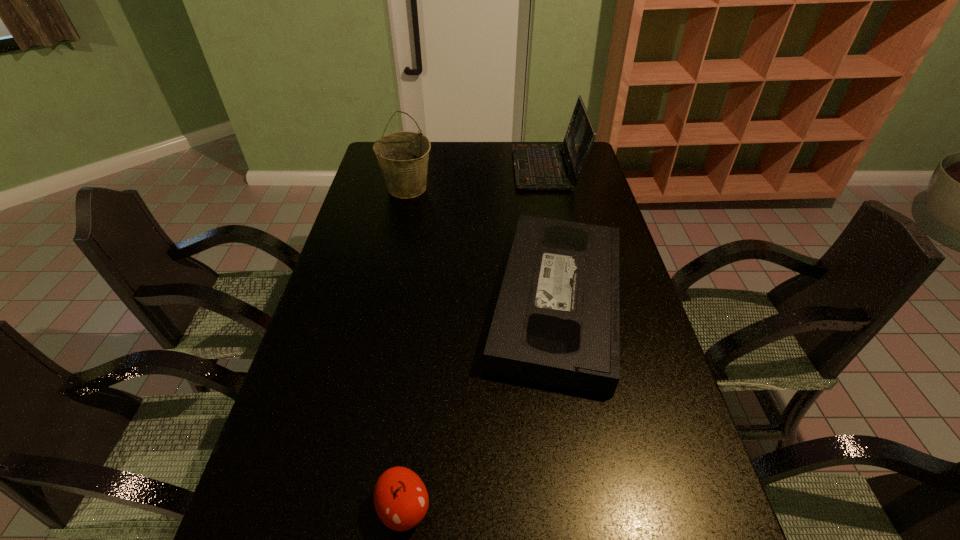
Locate an element on the screen. vacant area that lies between the videotape and the tallest object is located at coordinates (482, 245).

Locate an element on the screen. This screenshot has height=540, width=960. vacant area between the tallest object and the nearest object is located at coordinates pos(406,349).

Image resolution: width=960 pixels, height=540 pixels. In order to click on unoccupied position between the third shortest object and the nearest object in this screenshot , I will do pyautogui.click(x=475, y=339).

Where is `free space between the laptop computer and the tallest object`? This screenshot has width=960, height=540. free space between the laptop computer and the tallest object is located at coordinates (477, 179).

The height and width of the screenshot is (540, 960). Find the location of `free space between the tallest object and the videotape`. free space between the tallest object and the videotape is located at coordinates (482, 245).

In order to click on unoccupied area between the wine bucket and the nearest object in this screenshot , I will do `click(406, 349)`.

This screenshot has height=540, width=960. In order to click on free spot between the tallest object and the apple in this screenshot , I will do `click(406, 349)`.

I want to click on vacant area that lies between the second tallest object and the second shortest object, so click(475, 339).

This screenshot has height=540, width=960. I want to click on free spot between the third tallest object and the third shortest object, so click(475, 339).

Point out which object is positioned as the second nearest to the videotape. Please provide its 2D coordinates. Your answer should be formatted as a tuple, i.e. [(x, y)], where the tuple contains the x and y coordinates of a point satisfying the conditions above.

[(403, 157)]